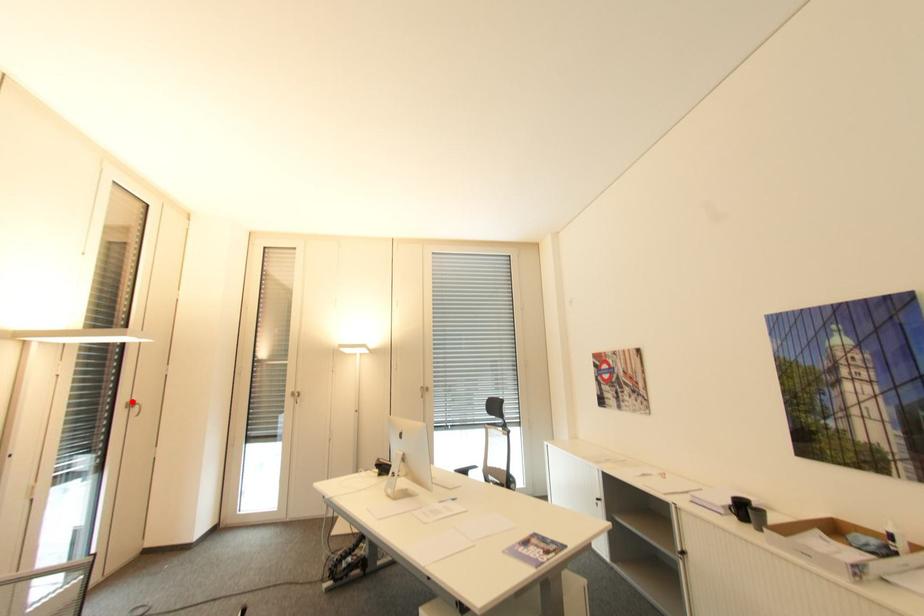
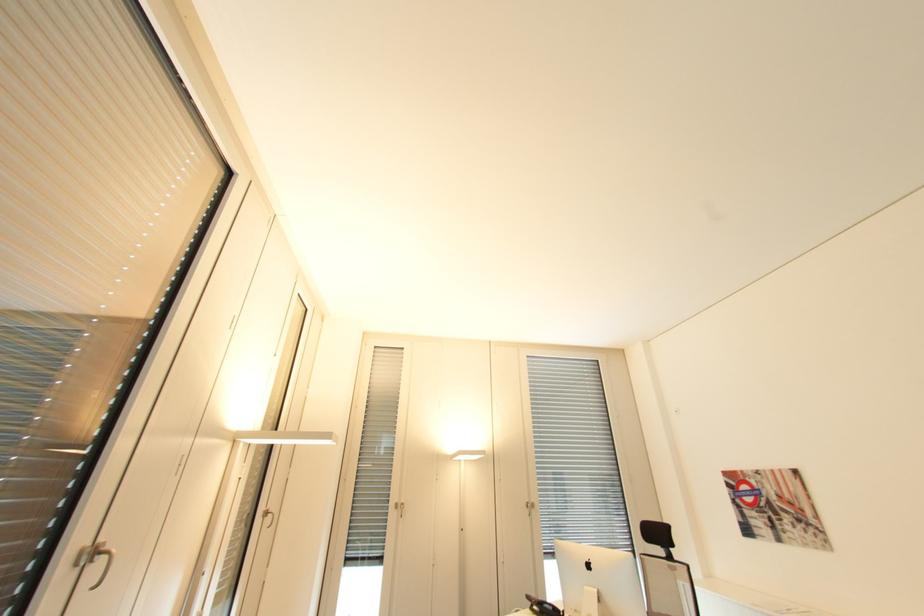
Find the pixel in the second image that matches the highlighted location in the first image.

(270, 511)